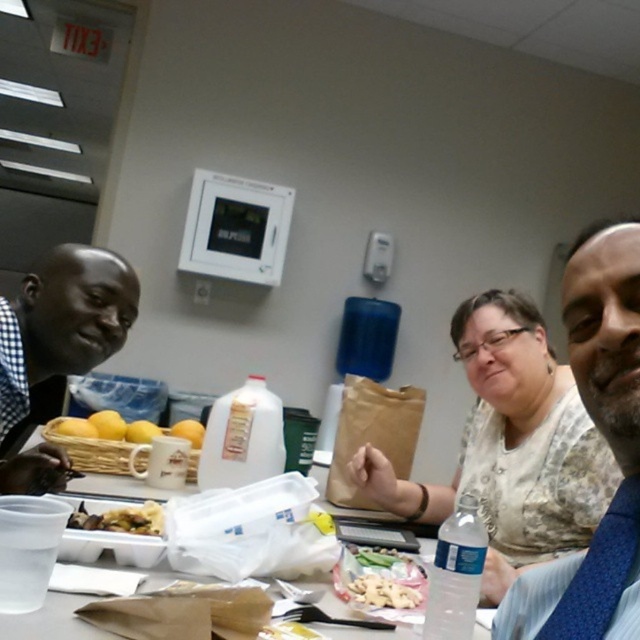
You are organizing a meeting in the conference room and need to place a 2cm wide ribbon next to the blue fabric tie at right. Can the white plastic table at center accommodate both items without overlapping?

The blue fabric tie at right is thinner than the white plastic table at center, so the table has enough space to place both the tie and the ribbon without overlapping.

In the image of the conference room table, where are the yellow matte lemons at center located?

The yellow matte lemons at center are located at point (108, 428).